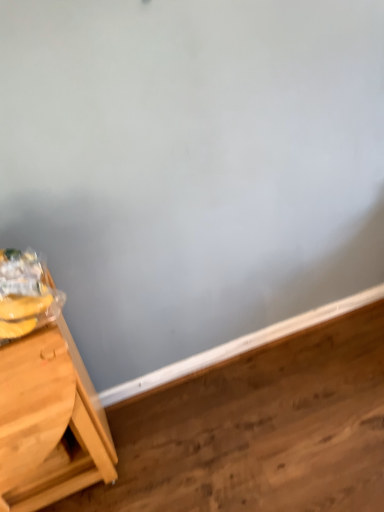
Describe the element at coordinates (49, 422) in the screenshot. I see `light brown wooden table at left` at that location.

Locate an element on the screen. The width and height of the screenshot is (384, 512). light brown wooden table at left is located at coordinates (49, 422).

What are the coordinates of `wooden at lower left` in the screenshot? It's located at (258, 429).

What do you see at coordinates (258, 429) in the screenshot?
I see `wooden at lower left` at bounding box center [258, 429].

Identify the location of light brown wooden table at left. (49, 422).

Can you confirm if light brown wooden table at left is positioned to the left of wooden at lower left?

Indeed, light brown wooden table at left is positioned on the left side of wooden at lower left.

Is light brown wooden table at left closer to the viewer compared to wooden at lower left?

Yes, light brown wooden table at left is in front of wooden at lower left.

Which point is more distant from viewer, (36, 366) or (310, 411)?

The point (310, 411) is farther.

From the image's perspective, is light brown wooden table at left over wooden at lower left?

Yes, from the image's perspective, light brown wooden table at left is over wooden at lower left.

From the picture: From a real-world perspective, is light brown wooden table at left positioned above or below wooden at lower left?

Clearly, from a real-world perspective, light brown wooden table at left is above wooden at lower left.

Can you confirm if light brown wooden table at left is thinner than wooden at lower left?

Yes, light brown wooden table at left is thinner than wooden at lower left.

Does light brown wooden table at left have a lesser height compared to wooden at lower left?

No, light brown wooden table at left is not shorter than wooden at lower left.

Which of these two, light brown wooden table at left or wooden at lower left, is bigger?

light brown wooden table at left is bigger.

Is light brown wooden table at left positioned beyond the bounds of wooden at lower left?

Yes, light brown wooden table at left is outside of wooden at lower left.

Is light brown wooden table at left next to wooden at lower left?

No, light brown wooden table at left is not touching wooden at lower left.

Is light brown wooden table at left looking in the opposite direction of wooden at lower left?

No.

How different are the orientations of light brown wooden table at left and wooden at lower left in degrees?

1.91 degrees separate the facing orientations of light brown wooden table at left and wooden at lower left.

How distant is light brown wooden table at left from wooden at lower left?

The distance of light brown wooden table at left from wooden at lower left is 17.21 inches.

Image resolution: width=384 pixels, height=512 pixels. In the image, there is a light brown wooden table at left. Find the location of `plywood below it (from the image's perspective)`. plywood below it (from the image's perspective) is located at coordinates (x=258, y=429).

In the image, is wooden at lower left on the left side or the right side of light brown wooden table at left?

Clearly, wooden at lower left is on the right of light brown wooden table at left in the image.

Is wooden at lower left in front of or behind light brown wooden table at left in the image?

In the image, wooden at lower left appears behind light brown wooden table at left.

Does point (202, 477) come in front of point (84, 474)?

That is True.

From the image's perspective, which one is positioned higher, wooden at lower left or light brown wooden table at left?

light brown wooden table at left.

From a real-world perspective, which object rests below the other?

wooden at lower left is physically lower.

Which of these two, wooden at lower left or light brown wooden table at left, is wider?

wooden at lower left is wider.

Considering the sizes of objects wooden at lower left and light brown wooden table at left in the image provided, who is shorter, wooden at lower left or light brown wooden table at left?

Standing shorter between the two is wooden at lower left.

Who is bigger, wooden at lower left or light brown wooden table at left?

Bigger between the two is light brown wooden table at left.

Is light brown wooden table at left located within wooden at lower left?

Actually, light brown wooden table at left is outside wooden at lower left.

Is wooden at lower left far from light brown wooden table at left?

No, wooden at lower left is in close proximity to light brown wooden table at left.

In the scene shown: Could you tell me if wooden at lower left is facing light brown wooden table at left?

No, wooden at lower left is not oriented towards light brown wooden table at left.

Looking at this image, how many degrees apart are the facing directions of wooden at lower left and light brown wooden table at left?

1.91 degrees.

At what (x,y) coordinates should I click in order to perform the action: click on table on the left of wooden at lower left. Please return your answer as a coordinate pair (x, y). The image size is (384, 512). Looking at the image, I should click on (49, 422).

Locate an element on the screen. This screenshot has height=512, width=384. table located in front of the wooden at lower left is located at coordinates (49, 422).

Find the location of a particular element. The image size is (384, 512). plywood below the light brown wooden table at left (from the image's perspective) is located at coordinates (258, 429).